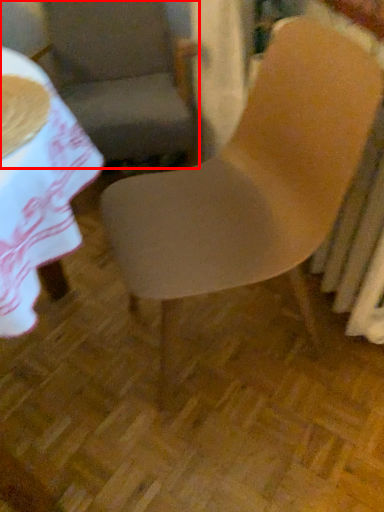
Question: Where is chair (annotated by the red box) located in relation to chair in the image?

Choices:
 (A) right
 (B) left

Answer: (B)